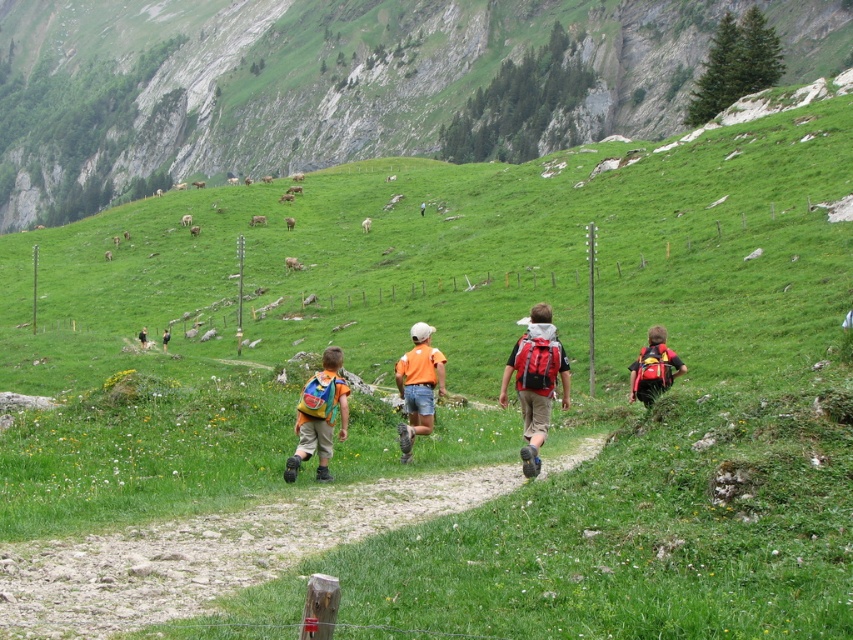
Is dirt path at center closer to the viewer compared to camouflage-patterned shorts at lower left?

Yes, dirt path at center is closer to the viewer.

Does point (230, 579) come farther from viewer compared to point (144, 336)?

No, (230, 579) is in front of (144, 336).

At what (x,y) coordinates should I click in order to perform the action: click on dirt path at center. Please return your answer as a coordinate pair (x, y). Looking at the image, I should click on (212, 552).

Does green grassy hillside at upper center have a greater height compared to orange fabric shorts at center?

Correct, green grassy hillside at upper center is much taller as orange fabric shorts at center.

Does point (398, 138) come in front of point (415, 378)?

No.

This screenshot has height=640, width=853. What do you see at coordinates (328, 81) in the screenshot?
I see `green grassy hillside at upper center` at bounding box center [328, 81].

You are a GUI agent. You are given a task and a screenshot of the screen. Output one action in this format:
    pyautogui.click(x=<x>, y=<y>)
    Task: Click on the green grassy hillside at upper center
    
    Given the screenshot: What is the action you would take?
    pyautogui.click(x=328, y=81)

The image size is (853, 640). What do you see at coordinates (318, 416) in the screenshot?
I see `matte yellow backpack at center` at bounding box center [318, 416].

Is point (308, 378) farther from viewer compared to point (167, 328)?

No, (308, 378) is in front of (167, 328).

Is point (299, 461) less distant than point (169, 332)?

Yes.

The image size is (853, 640). In order to click on matte yellow backpack at center in this screenshot , I will do `click(318, 416)`.